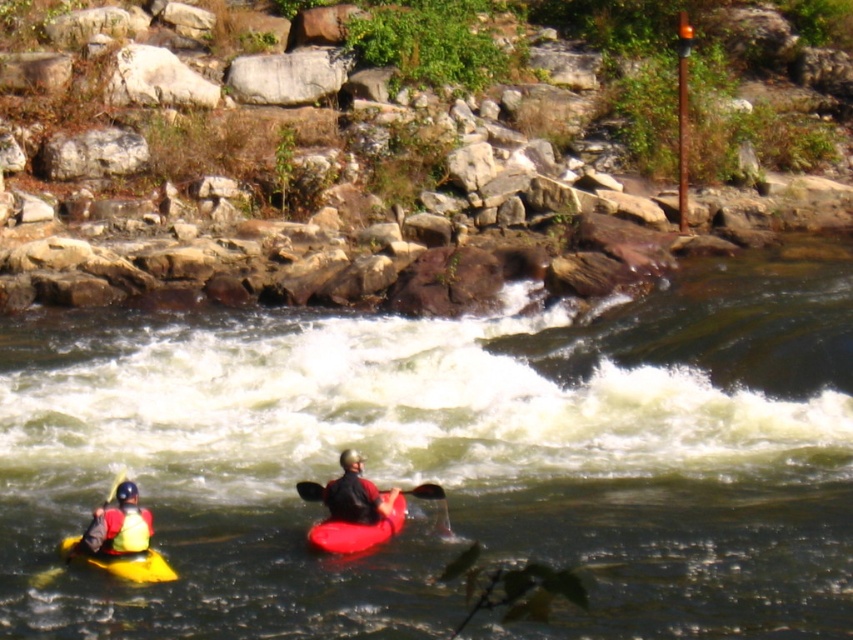
You are a safety officer assessing the river scene. The two kayaks, the matte black kayak at center and the yellow matte kayak at lower left, are in the river. Based on their positions, which kayak is closer to the starting point of the rapids?

The yellow matte kayak at lower left is behind the matte black kayak at center, so the matte black kayak at center is closer to the starting point of the rapids.

You are a kayaker planning to navigate the river section shown. You see the rough textured rocks at upper center and the yellow matte kayak at lower left. Which object is positioned higher in the image?

The rough textured rocks at upper center is positioned higher in the image as it is much taller than the yellow matte kayak at lower left.

You are a kayaker planning to navigate the river section shown in the image. You see the rough textured rocks at upper center and the yellow matte kayak at lower left. Based on their distance, can you safely pass between them without hitting either? Please explain.

The rough textured rocks at upper center and yellow matte kayak at lower left are 18.37 meters apart from each other. Since the distance is relatively large, you can safely pass between them without hitting either object as there is sufficient space.